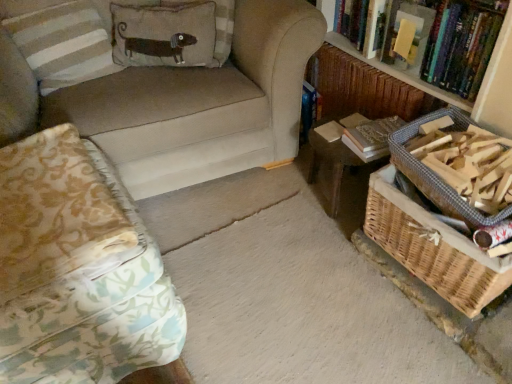
Question: Considering the relative positions of hardcover book at upper right and woven brown basket at lower right, the first basket positioned from the bottom, in the image provided, is hardcover book at upper right to the right of woven brown basket at lower right, the first basket positioned from the bottom, from the viewer's perspective?

Choices:
 (A) yes
 (B) no

Answer: (B)

Question: Is woven brown basket at lower right, the second basket when ordered from top to bottom, at the back of hardcover book at upper right?

Choices:
 (A) no
 (B) yes

Answer: (A)

Question: Considering the relative sizes of hardcover book at upper right and woven brown basket at lower right, the first basket positioned from the bottom, in the image provided, is hardcover book at upper right taller than woven brown basket at lower right, the first basket positioned from the bottom,?

Choices:
 (A) no
 (B) yes

Answer: (B)

Question: Is hardcover book at upper right far from woven brown basket at lower right, the first basket positioned from the bottom?

Choices:
 (A) yes
 (B) no

Answer: (B)

Question: Does hardcover book at upper right have a lesser height compared to woven brown basket at lower right, the second basket when ordered from top to bottom?

Choices:
 (A) yes
 (B) no

Answer: (B)

Question: From the image's perspective, is hardcover book at upper right above woven brown basket at lower right, the first basket positioned from the bottom?

Choices:
 (A) no
 (B) yes

Answer: (B)

Question: Considering the relative sizes of woven wood basket at lower right, which is the 1th basket from top to bottom, and patterned fabric studio couch at left, placed as the 1th studio couch when sorted from bottom to top, in the image provided, is woven wood basket at lower right, which is the 1th basket from top to bottom, smaller than patterned fabric studio couch at left, placed as the 1th studio couch when sorted from bottom to top,?

Choices:
 (A) no
 (B) yes

Answer: (B)

Question: Is woven wood basket at lower right, which is the 1th basket from top to bottom, not close to patterned fabric studio couch at left, placed as the 1th studio couch when sorted from bottom to top?

Choices:
 (A) yes
 (B) no

Answer: (B)

Question: Can you confirm if woven wood basket at lower right, which appears as the 2th basket when ordered from the bottom, is positioned to the left of patterned fabric studio couch at left, which appears as the second studio couch when viewed from the top?

Choices:
 (A) no
 (B) yes

Answer: (A)

Question: From the image's perspective, is woven wood basket at lower right, which appears as the 2th basket when ordered from the bottom, over patterned fabric studio couch at left, which appears as the second studio couch when viewed from the top?

Choices:
 (A) yes
 (B) no

Answer: (A)

Question: Is woven wood basket at lower right, which appears as the 2th basket when ordered from the bottom, facing towards patterned fabric studio couch at left, placed as the 1th studio couch when sorted from bottom to top?

Choices:
 (A) yes
 (B) no

Answer: (A)

Question: Is patterned fabric studio couch at left, placed as the 1th studio couch when sorted from bottom to top, completely or partially inside woven wood basket at lower right, which is the 1th basket from top to bottom?

Choices:
 (A) no
 (B) yes

Answer: (A)

Question: Is striped fabric pillow at upper left, which appears as the first pillow when viewed from the left, to the right of patterned fabric studio couch at left, which appears as the second studio couch when viewed from the top, from the viewer's perspective?

Choices:
 (A) no
 (B) yes

Answer: (A)